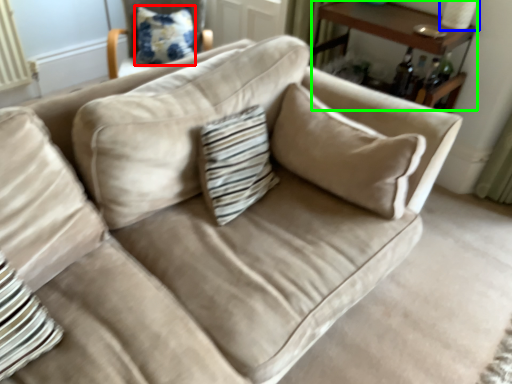
Question: Which object is the farthest from pillow (highlighted by a red box)? Choose among these: table lamp (highlighted by a blue box) or table (highlighted by a green box).

Choices:
 (A) table lamp
 (B) table

Answer: (A)